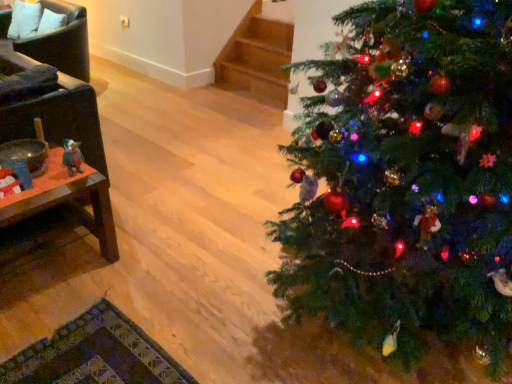
This screenshot has width=512, height=384. I want to click on vacant area that lies to the right of dark brown leather armchair at left, the 1th armchair viewed from the front, so click(154, 193).